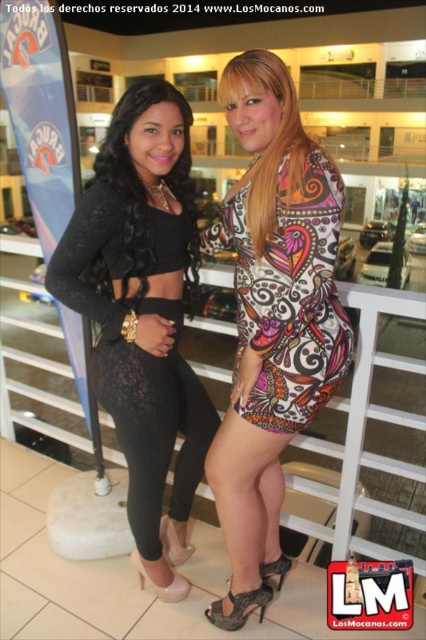
Who is higher up, black lace dress at left or black lace top at center?

black lace top at center is above.

Is black lace dress at left above black lace top at center?

No.

Is point (181, 449) positioned behind point (106, 160)?

That is True.

Locate an element on the screen. The width and height of the screenshot is (426, 640). black lace dress at left is located at coordinates (143, 314).

What do you see at coordinates (143, 180) in the screenshot? This screenshot has width=426, height=640. I see `black lace top at center` at bounding box center [143, 180].

Is black lace top at center below matte black dress at center?

Yes.

Is point (132, 176) less distant than point (308, 145)?

No, (132, 176) is behind (308, 145).

Locate an element on the screen. Image resolution: width=426 pixels, height=640 pixels. black lace top at center is located at coordinates (143, 180).

Is black lace dress at left closer to the viewer compared to matte black dress at center?

No.

Does black lace dress at left have a greater height compared to matte black dress at center?

Yes, black lace dress at left is taller than matte black dress at center.

You are a GUI agent. You are given a task and a screenshot of the screen. Output one action in this format:
    pyautogui.click(x=<x>, y=<y>)
    Task: Click on the black lace dress at left
    Image resolution: width=426 pixels, height=640 pixels.
    Given the screenshot: What is the action you would take?
    pyautogui.click(x=143, y=314)